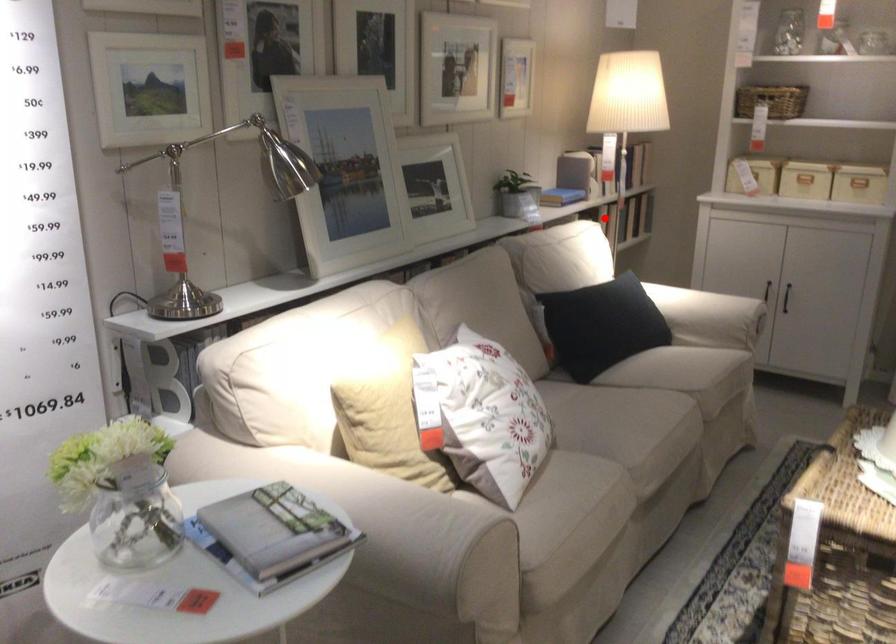
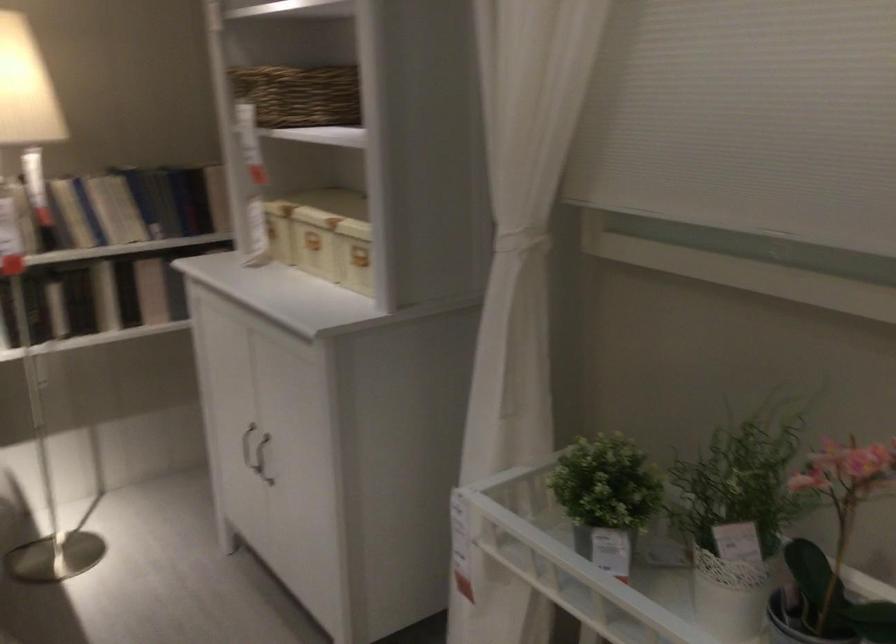
Question: I am providing you with two images of the same scene from different viewpoints. Image1 has a red point marked. In image2, the corresponding 3D location appears at what relative position? Reply with the corresponding letter.

Choices:
 (A) Closer
 (B) Farther

Answer: (A)